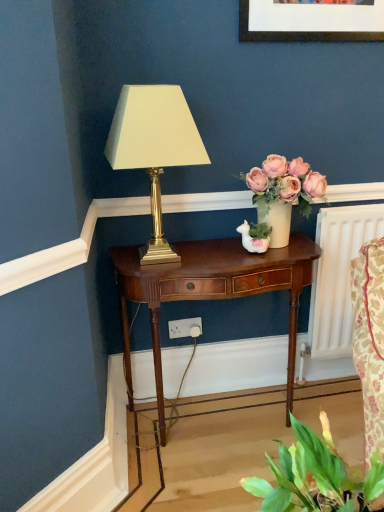
This screenshot has height=512, width=384. I want to click on free space between gold metallic lamp at center and matte cream vase with pink roses at center, so (226, 251).